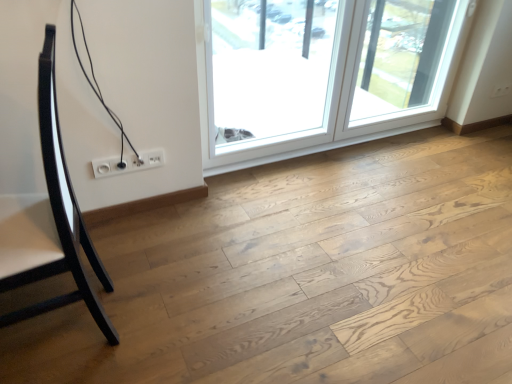
Locate an element on the screen. vacant area that lies between glossy black chair at left and transparent glass screen door at upper right is located at coordinates (221, 234).